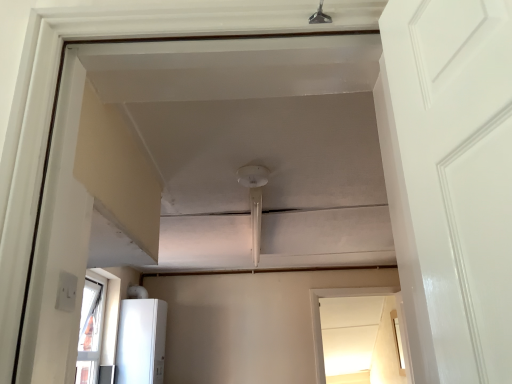
Question: In terms of width, does white glossy refrigerator at lower left look wider or thinner when compared to transparent glass window at center?

Choices:
 (A) thin
 (B) wide

Answer: (B)

Question: Relative to transparent glass window at center, is white glossy refrigerator at lower left in front or behind?

Choices:
 (A) behind
 (B) front

Answer: (B)

Question: Is white glossy refrigerator at lower left to the left or to the right of transparent glass window at center in the image?

Choices:
 (A) left
 (B) right

Answer: (A)

Question: Is point (320, 336) closer or farther from the camera than point (131, 354)?

Choices:
 (A) farther
 (B) closer

Answer: (A)

Question: Is transparent glass window at center bigger or smaller than white glossy refrigerator at lower left?

Choices:
 (A) small
 (B) big

Answer: (A)

Question: In the image, is transparent glass window at center positioned in front of or behind white glossy refrigerator at lower left?

Choices:
 (A) front
 (B) behind

Answer: (B)

Question: From a real-world perspective, is transparent glass window at center above or below white glossy refrigerator at lower left?

Choices:
 (A) below
 (B) above

Answer: (A)